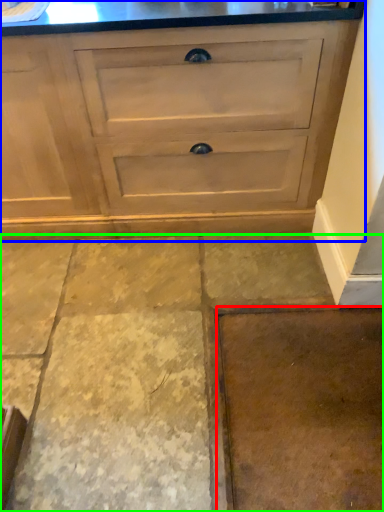
Question: Based on their relative distances, which object is farther from concrete (highlighted by a red box)? Choose from chest of drawers (highlighted by a blue box) and concrete (highlighted by a green box).

Choices:
 (A) chest of drawers
 (B) concrete

Answer: (A)